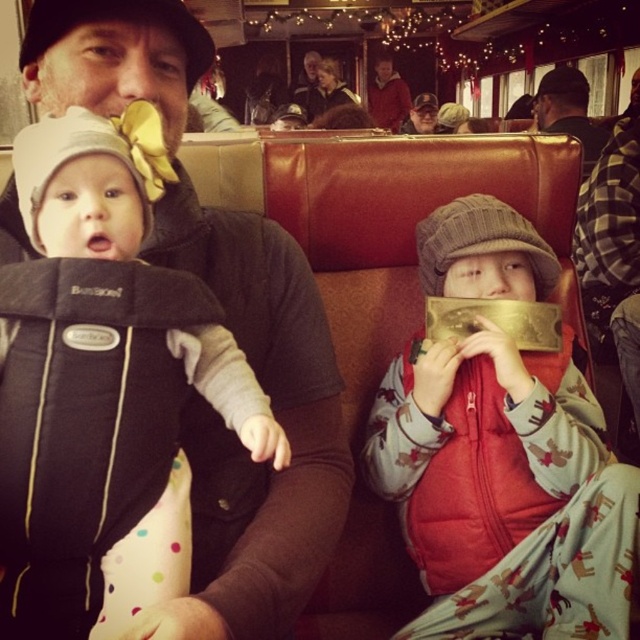
Question: Does red fleece vest at center have a smaller size compared to matte black jacket at center?

Choices:
 (A) yes
 (B) no

Answer: (A)

Question: Can you confirm if soft black fabric baby carrier at left is positioned to the right of matte black jacket at center?

Choices:
 (A) no
 (B) yes

Answer: (A)

Question: Among these points, which one is farthest from the camera?

Choices:
 (A) (600, 148)
 (B) (444, 214)

Answer: (A)

Question: Which point appears farthest from the camera in this image?

Choices:
 (A) (544, 81)
 (B) (131, 584)
 (C) (486, 547)

Answer: (A)

Question: Which of the following is the closest to the observer?

Choices:
 (A) red fleece vest at center
 (B) soft black fabric baby carrier at left

Answer: (B)

Question: Is the position of red fleece vest at center less distant than that of matte black jacket at center?

Choices:
 (A) yes
 (B) no

Answer: (A)